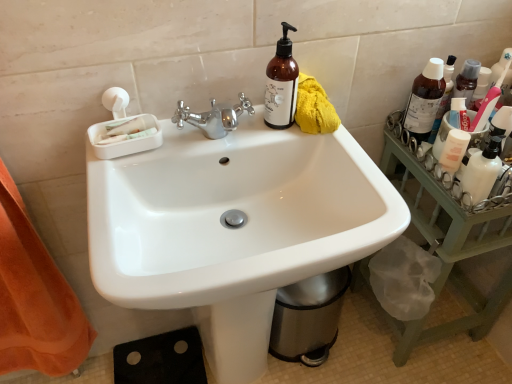
Question: Can you confirm if transparent plastic bottle at upper right, which is the second bottle from right to left, is thinner than green wood tray at right?

Choices:
 (A) yes
 (B) no

Answer: (A)

Question: Is transparent plastic bottle at upper right, acting as the second bottle starting from the left, touching green wood tray at right?

Choices:
 (A) yes
 (B) no

Answer: (B)

Question: Is transparent plastic bottle at upper right, which is the second bottle from right to left, facing towards green wood tray at right?

Choices:
 (A) yes
 (B) no

Answer: (B)

Question: From the image's perspective, is transparent plastic bottle at upper right, acting as the second bottle starting from the left, beneath green wood tray at right?

Choices:
 (A) yes
 (B) no

Answer: (B)

Question: Are transparent plastic bottle at upper right, acting as the second bottle starting from the left, and green wood tray at right far apart?

Choices:
 (A) no
 (B) yes

Answer: (A)

Question: Is transparent plastic bottle at upper right, acting as the second bottle starting from the left, completely or partially outside of green wood tray at right?

Choices:
 (A) no
 (B) yes

Answer: (B)

Question: Is brown glass bottle at upper right, arranged as the first bottle when viewed from the left, located within white glossy mouthwash at right?

Choices:
 (A) yes
 (B) no

Answer: (B)

Question: Is white glossy mouthwash at right to the left of brown glass bottle at upper right, arranged as the first bottle when viewed from the left, from the viewer's perspective?

Choices:
 (A) yes
 (B) no

Answer: (B)

Question: From a real-world perspective, is white glossy mouthwash at right physically below brown glass bottle at upper right, arranged as the first bottle when viewed from the left?

Choices:
 (A) yes
 (B) no

Answer: (A)

Question: Is white glossy mouthwash at right facing towards brown glass bottle at upper right, arranged as the first bottle when viewed from the left?

Choices:
 (A) no
 (B) yes

Answer: (A)

Question: Can you confirm if white glossy mouthwash at right is positioned to the right of brown glass bottle at upper right, arranged as the first bottle when viewed from the left?

Choices:
 (A) no
 (B) yes

Answer: (B)

Question: Considering the relative sizes of white glossy mouthwash at right and brown glass bottle at upper right, arranged as the first bottle when viewed from the left, in the image provided, is white glossy mouthwash at right taller than brown glass bottle at upper right, arranged as the first bottle when viewed from the left,?

Choices:
 (A) yes
 (B) no

Answer: (B)

Question: Can you confirm if white glossy mouthwash at right is bigger than translucent plastic bottle at upper right, which is the 3th bottle from left to right?

Choices:
 (A) yes
 (B) no

Answer: (B)